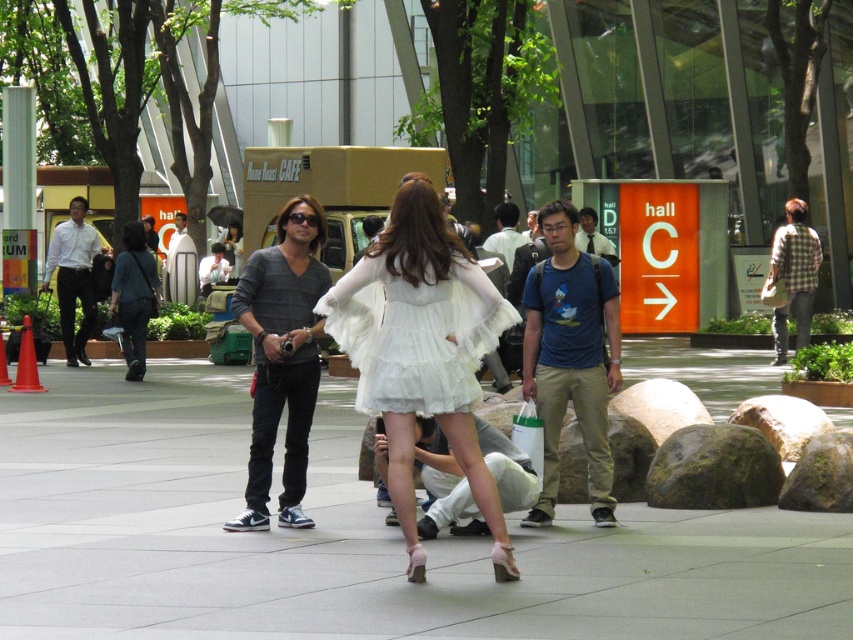
Between point (596, 337) and point (267, 400), which one is positioned behind?

Point (596, 337)

Is point (532, 333) positioned behind point (296, 413)?

Yes, it is behind point (296, 413).

Image resolution: width=853 pixels, height=640 pixels. Find the location of `blue cotton t-shirt at center`. blue cotton t-shirt at center is located at coordinates (570, 356).

Does white lace dress at center lie in front of gray sweater at center?

Yes, white lace dress at center is in front of gray sweater at center.

What do you see at coordinates (422, 353) in the screenshot? The width and height of the screenshot is (853, 640). I see `white lace dress at center` at bounding box center [422, 353].

This screenshot has width=853, height=640. I want to click on white lace dress at center, so click(422, 353).

Can you confirm if matte black jacket at left is positioned below matte gray sweater at center?

Yes.

Does matte black jacket at left have a greater height compared to matte gray sweater at center?

Yes, matte black jacket at left is taller than matte gray sweater at center.

Is point (131, 340) positioned behind point (218, 241)?

No, it is in front of (218, 241).

Where is `matte black jacket at left`? This screenshot has height=640, width=853. matte black jacket at left is located at coordinates (134, 296).